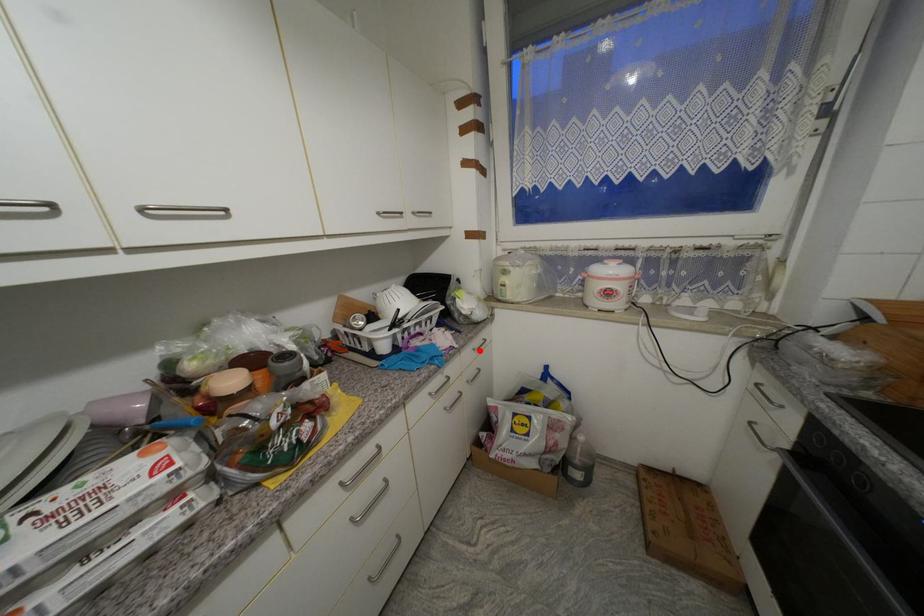
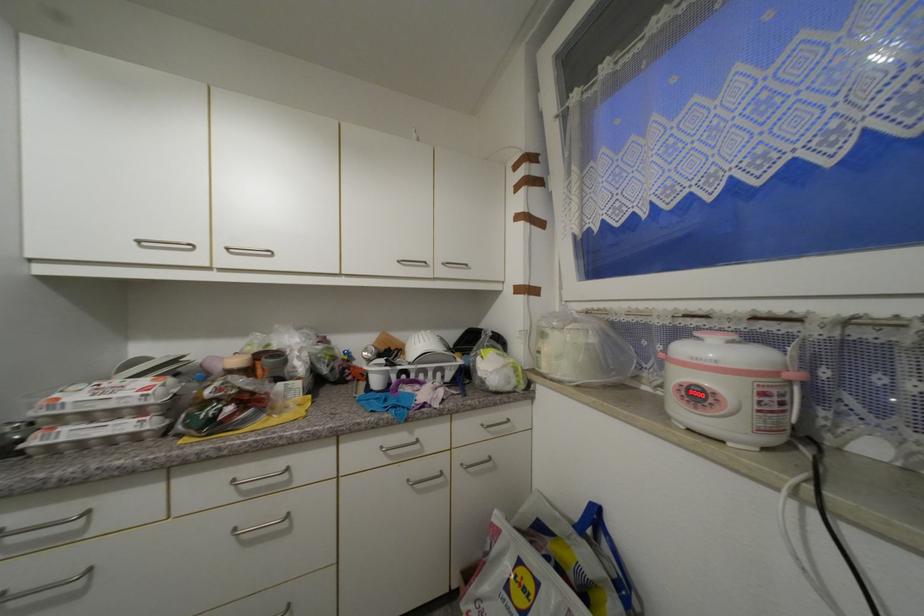
Find the pixel in the second image that matches the highlighted location in the first image.

(488, 427)